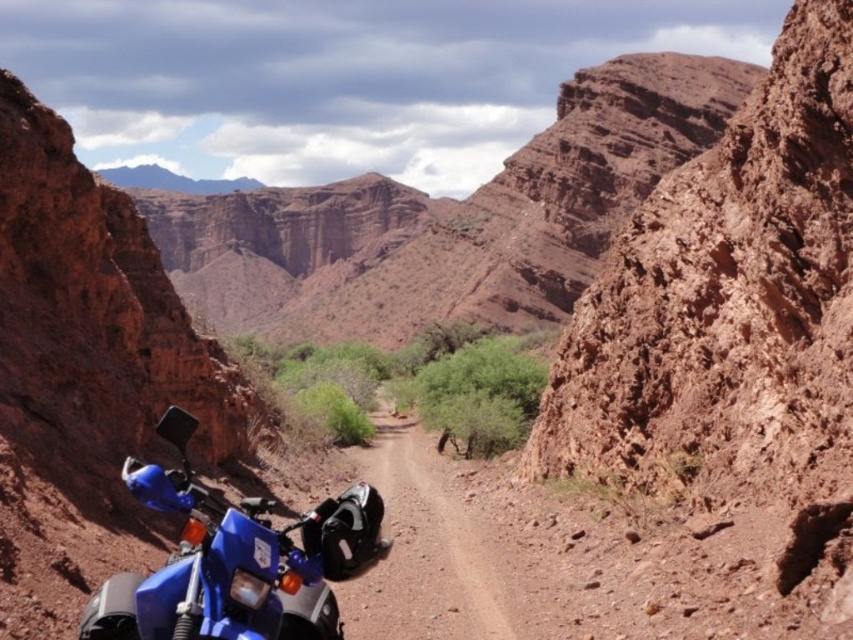
Does blue matte motorcycle at lower left appear under dirt/granular mountain path at center?

No.

The height and width of the screenshot is (640, 853). I want to click on blue matte motorcycle at lower left, so click(235, 561).

The width and height of the screenshot is (853, 640). What are the coordinates of `blue matte motorcycle at lower left` in the screenshot? It's located at (235, 561).

The height and width of the screenshot is (640, 853). I want to click on rustic rock formation at center, so click(x=448, y=220).

Which is more to the right, rustic rock formation at center or dirt/granular mountain path at center?

dirt/granular mountain path at center

Does point (392, 240) lie behind point (424, 438)?

Yes, point (392, 240) is behind point (424, 438).

Where is `rustic rock formation at center`? This screenshot has height=640, width=853. rustic rock formation at center is located at coordinates (448, 220).

From the picture: Which of these two, rustic rock formation at center or blue matte motorcycle at lower left, stands taller?

rustic rock formation at center

The height and width of the screenshot is (640, 853). Describe the element at coordinates (448, 220) in the screenshot. I see `rustic rock formation at center` at that location.

At what (x,y) coordinates should I click in order to perform the action: click on rustic rock formation at center. Please return your answer as a coordinate pair (x, y). Looking at the image, I should click on (448, 220).